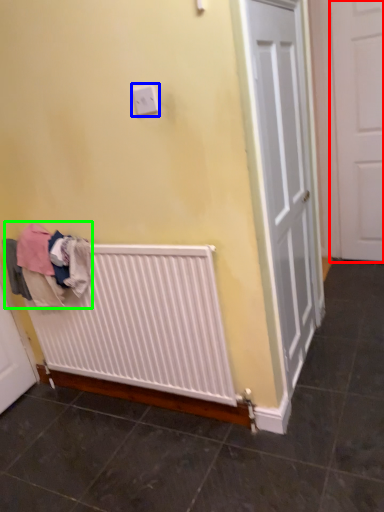
Question: Which object is the farthest from door (highlighted by a red box)? Choose among these: electric outlet (highlighted by a blue box) or clothing (highlighted by a green box).

Choices:
 (A) electric outlet
 (B) clothing

Answer: (B)